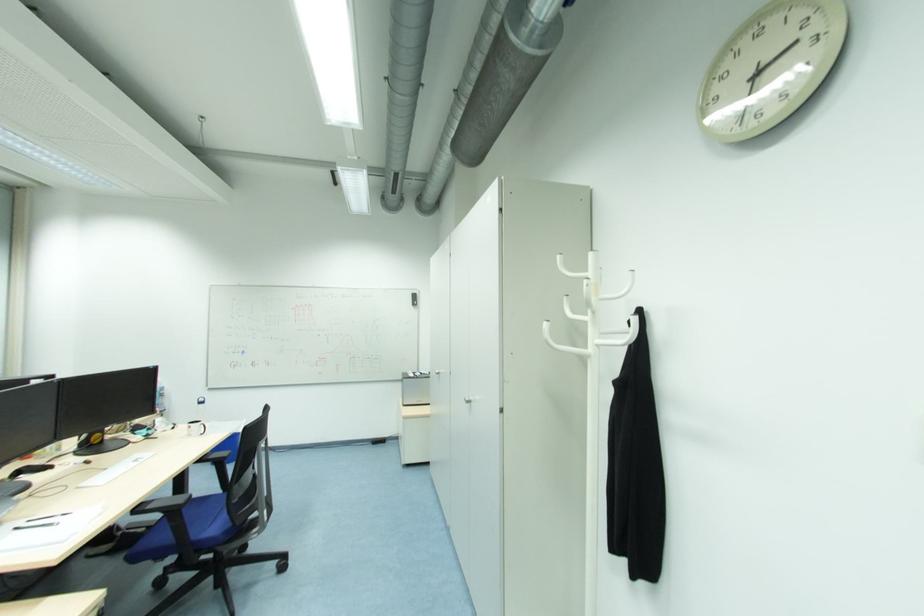
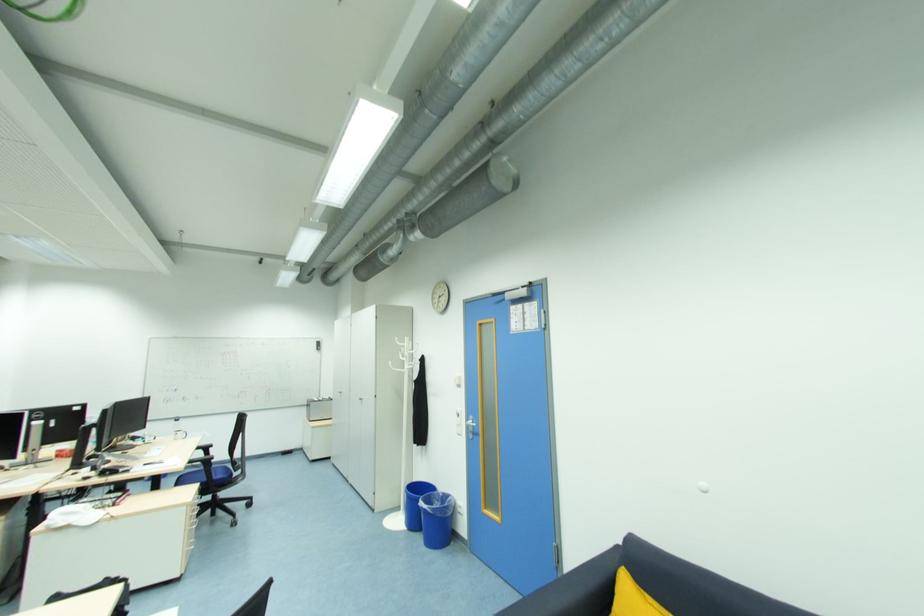
The point at (596, 341) is marked in the first image. Where is the corresponding point in the second image?

(409, 368)